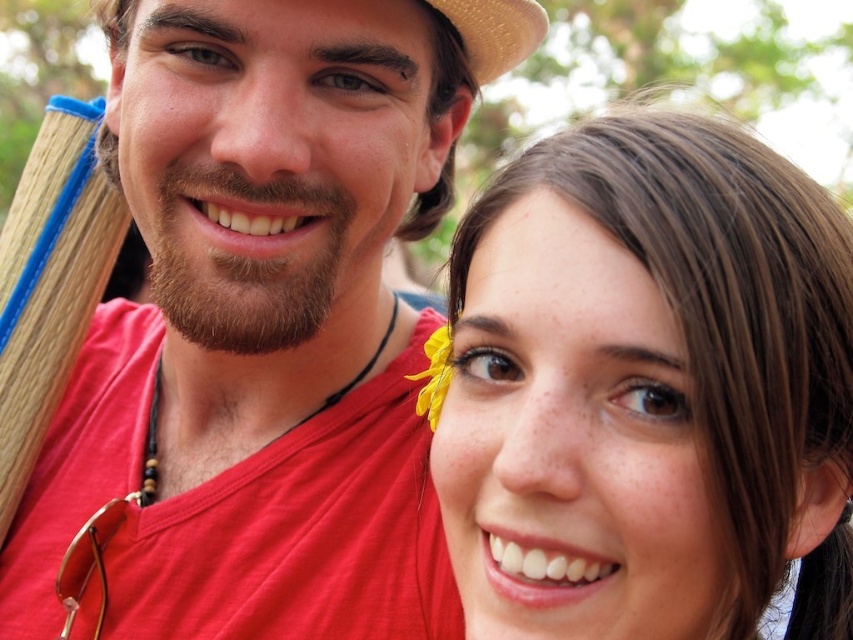
Question: Which of the following is the farthest from the observer?

Choices:
 (A) smooth brown hair at center
 (B) yellow fabric flower at upper center
 (C) matte red shirt at left

Answer: (C)

Question: Does matte red shirt at left appear under smooth brown hair at center?

Choices:
 (A) no
 (B) yes

Answer: (A)

Question: Which object appears farthest from the camera in this image?

Choices:
 (A) smooth brown hair at center
 (B) yellow fabric flower at upper center

Answer: (B)

Question: Which point appears closest to the camera in this image?

Choices:
 (A) coord(399,561)
 (B) coord(676,556)

Answer: (B)

Question: Is matte red shirt at left to the right of smooth brown hair at center from the viewer's perspective?

Choices:
 (A) no
 (B) yes

Answer: (A)

Question: Does matte red shirt at left appear over yellow fabric flower at upper center?

Choices:
 (A) yes
 (B) no

Answer: (A)